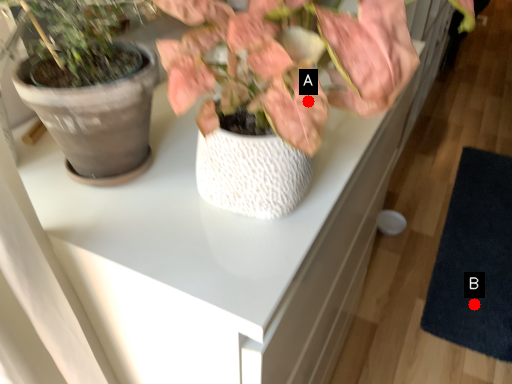
Question: Two points are circled on the image, labeled by A and B beside each circle. Among these points, which one is farthest from the camera?

Choices:
 (A) A is further
 (B) B is further

Answer: (B)